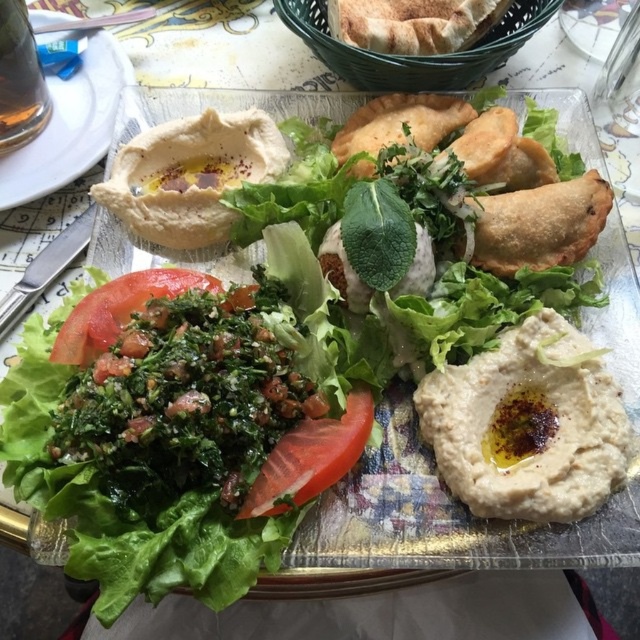
Describe the element at coordinates (310, 458) in the screenshot. The image size is (640, 640). I see `red matte tomato at center` at that location.

Between red matte tomato at center and transparent glass at upper left, which one appears on the right side from the viewer's perspective?

Positioned to the right is red matte tomato at center.

Is point (276, 486) positioned before point (28, 90)?

That is True.

Locate an element on the screen. The image size is (640, 640). red matte tomato at center is located at coordinates (310, 458).

Does red matte tomato at center have a larger size compared to red/greenish matte/tender tomato at center-left?

Incorrect, red matte tomato at center is not larger than red/greenish matte/tender tomato at center-left.

Is red matte tomato at center positioned at the back of red/greenish matte/tender tomato at center-left?

That is False.

Measure the distance between red matte tomato at center and camera.

red matte tomato at center is 23.85 inches from camera.

The height and width of the screenshot is (640, 640). I want to click on red matte tomato at center, so click(310, 458).

Who is higher up, green leafy salad at center or transparent glass at upper left?

transparent glass at upper left

The height and width of the screenshot is (640, 640). What do you see at coordinates (157, 444) in the screenshot?
I see `green leafy salad at center` at bounding box center [157, 444].

Measure the distance between point (x=273, y=412) and camera.

They are 25.80 inches apart.

I want to click on green leafy salad at center, so click(x=157, y=444).